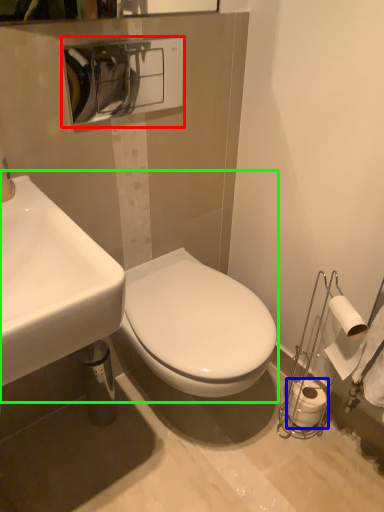
Question: Which object is the closest to the hand dryer (highlighted by a red box)? Choose among these: toilet paper (highlighted by a blue box) or sink (highlighted by a green box).

Choices:
 (A) toilet paper
 (B) sink

Answer: (B)